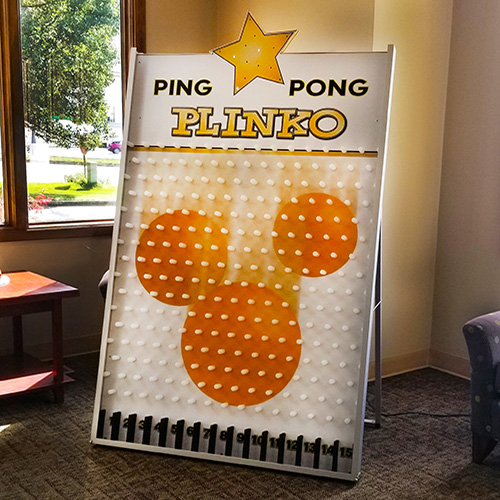
The width and height of the screenshot is (500, 500). What are the coordinates of `chair arm` in the screenshot? It's located at (481, 342).